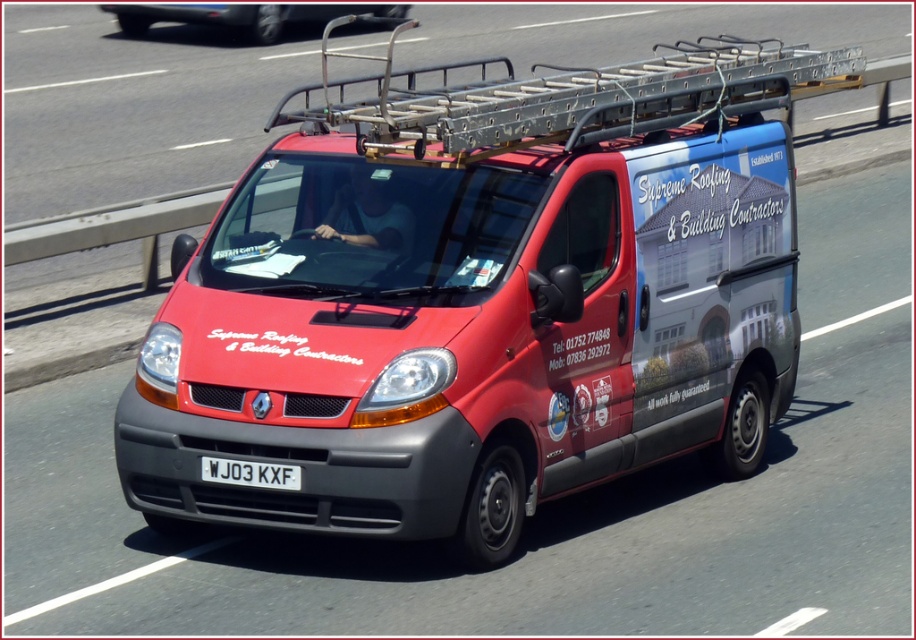
Between point (553, 451) and point (373, 16), which one is positioned in front?

Point (553, 451) is more forward.

Identify the location of matte red van at center. (481, 298).

Who is higher up, metallic silver van at center or white plastic license plate at center?

metallic silver van at center is above.

Which of these two, metallic silver van at center or white plastic license plate at center, stands shorter?

With less height is white plastic license plate at center.

What do you see at coordinates (245, 16) in the screenshot? Image resolution: width=916 pixels, height=640 pixels. I see `metallic silver van at center` at bounding box center [245, 16].

Identify the location of metallic silver van at center. This screenshot has height=640, width=916. (245, 16).

Is matte red van at center positioned before white plastic license plate at center?

No, it is behind white plastic license plate at center.

Is matte red van at center bigger than white plastic license plate at center?

Yes.

Which is behind, point (431, 381) or point (258, 472)?

Point (258, 472)

You are a GUI agent. You are given a task and a screenshot of the screen. Output one action in this format:
    pyautogui.click(x=<x>, y=<y>)
    Task: Click on the matte red van at center
    The image size is (916, 640).
    Given the screenshot: What is the action you would take?
    pyautogui.click(x=481, y=298)